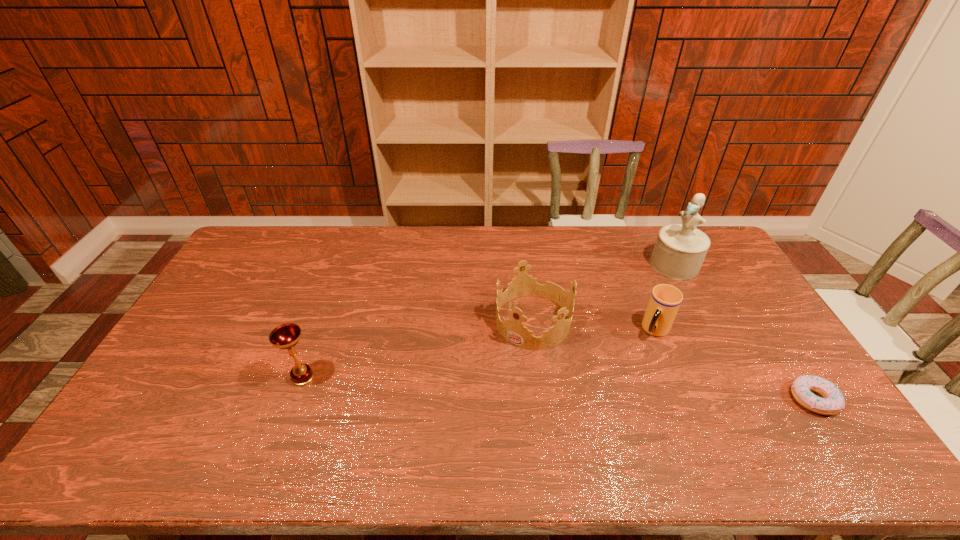
The height and width of the screenshot is (540, 960). Identify the location of doughnut at the right edge. (832, 403).

Where is `figurine at the right edge`? This screenshot has height=540, width=960. figurine at the right edge is located at coordinates (680, 249).

This screenshot has width=960, height=540. What are the coordinates of `object that is at the far right corner` in the screenshot? It's located at [x=680, y=249].

At what (x,y) coordinates should I click in order to perform the action: click on object positioned at the near right corner. Please return your answer as a coordinate pair (x, y). Looking at the image, I should click on (832, 403).

In the image, there is a desktop. Identify the location of vacant space at the far edge. (345, 244).

Find the location of a particular element. The width and height of the screenshot is (960, 540). vacant space at the near edge of the desktop is located at coordinates coord(399,428).

Image resolution: width=960 pixels, height=540 pixels. I want to click on free space at the left edge, so click(x=233, y=265).

Image resolution: width=960 pixels, height=540 pixels. What are the coordinates of `free spot at the right edge of the desktop` in the screenshot? It's located at (756, 314).

Image resolution: width=960 pixels, height=540 pixels. In the image, there is a desktop. Find the location of `vacant space at the far left corner`. vacant space at the far left corner is located at coordinates (270, 244).

Find the location of a particular element. The image size is (960, 540). free spot at the near left corner of the desktop is located at coordinates (181, 414).